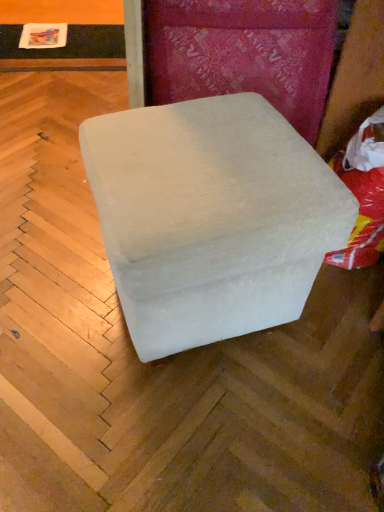
Where is `blank space to the left of white fabric ottoman at center`? Image resolution: width=384 pixels, height=512 pixels. blank space to the left of white fabric ottoman at center is located at coordinates (55, 287).